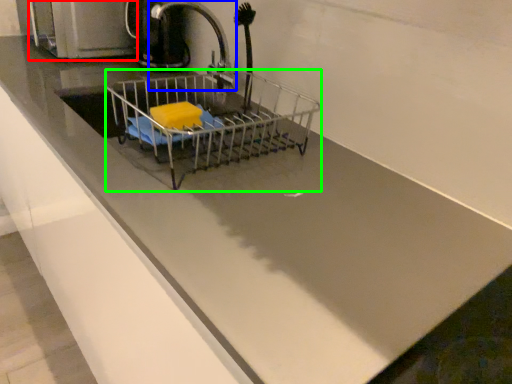
Question: Considering the real-world distances, which object is farthest from appliance (highlighted by a red box)? tap (highlighted by a blue box) or shopping cart (highlighted by a green box)?

Choices:
 (A) tap
 (B) shopping cart

Answer: (B)